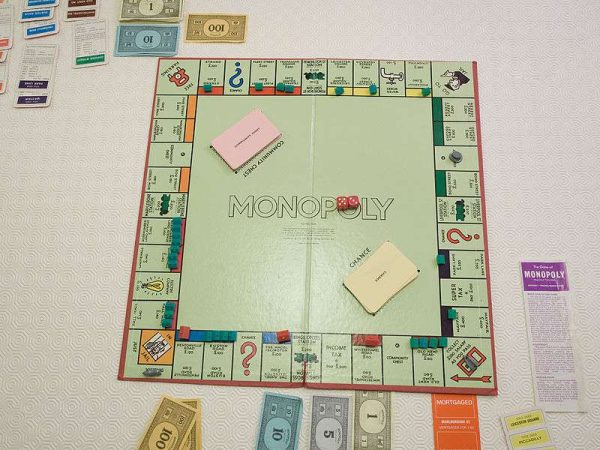
The width and height of the screenshot is (600, 450). What are the coordinates of `monopoly money` in the screenshot? It's located at (172, 423), (191, 436), (278, 432), (325, 433), (367, 432), (163, 11), (213, 24), (159, 39).